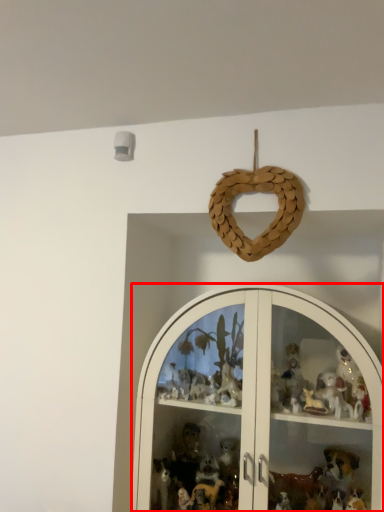
Question: From the image's perspective, considering the relative positions of shelf (annotated by the red box) and toy in the image provided, where is shelf (annotated by the red box) located with respect to the staircase?

Choices:
 (A) above
 (B) below

Answer: (B)